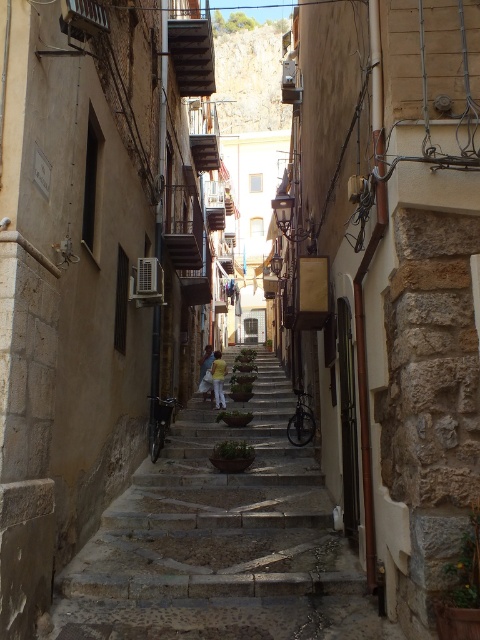
You are a tourist standing at the bottom of the alleyway and see the stone textured stairs at center and the light blue jeans at center. Which object is closer to you?

The stone textured stairs at center is positioned under light blue jeans at center, so the light blue jeans at center is closer to you.

You are standing in the middle of the alley and see the stone textured stairs at center and the yellow cotton shirt at center. Which object is positioned to the right of the other?

The stone textured stairs at center are to the right of the yellow cotton shirt at center.